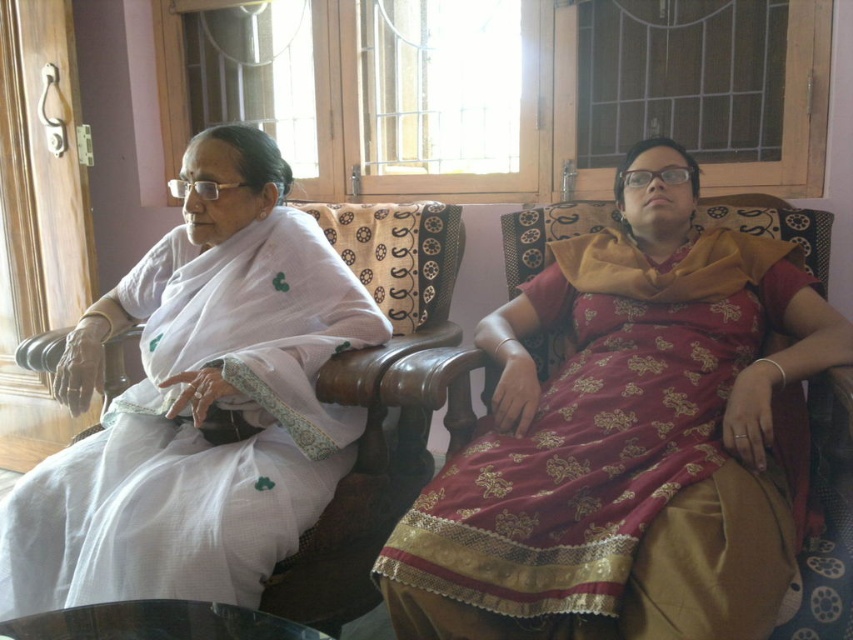
Looking at this image, you are a tailor measuring the distance between two sarees on the sofa for a fitting. The maroon satin saree at center and the white cotton saree at left are part of a display. Can you fit a 45 cm wide decorative pillow between them?

The maroon satin saree at center and white cotton saree at left are 47.72 centimeters apart from each other. Since 47.72 cm is greater than 45 cm, the decorative pillow can fit between them.

You are a photographer setting up a shoot in this living room. You need to ensure that both the maroon satin saree at center and the white cotton saree at left are visible in the frame. Given that the camera is positioned at eye level, which saree should you focus on first to ensure depth of field captures both clearly?

You should focus on the maroon satin saree at center first since it is closer to the viewer than the white cotton saree at left. By focusing on the closer object, the depth of field will extend backward, increasing the likelihood that both sarees are in focus.